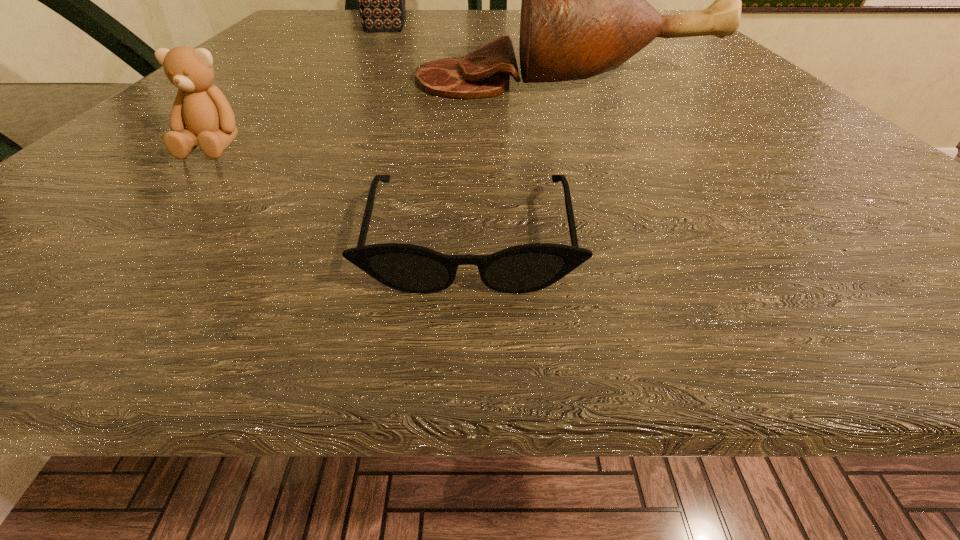
At what (x,y) coordinates should I click in order to perform the action: click on vacant space that satisfies the following two spatial constraints: 1. at the sliced end of the ham; 2. on the face of the third farthest object. Please return your answer as a coordinate pair (x, y). The width and height of the screenshot is (960, 540). Looking at the image, I should click on (595, 145).

Where is `free space that satisfies the following two spatial constraints: 1. at the sliced end of the ham; 2. on the face of the second shortest object`? This screenshot has width=960, height=540. free space that satisfies the following two spatial constraints: 1. at the sliced end of the ham; 2. on the face of the second shortest object is located at coordinates (595, 145).

This screenshot has height=540, width=960. Identify the location of vacant position in the image that satisfies the following two spatial constraints: 1. with the zip open on the third object from right to left; 2. on the face of the teddy bear. (308, 145).

The height and width of the screenshot is (540, 960). I want to click on vacant area that satisfies the following two spatial constraints: 1. with the zip open on the third object from right to left; 2. on the face of the third farthest object, so click(308, 145).